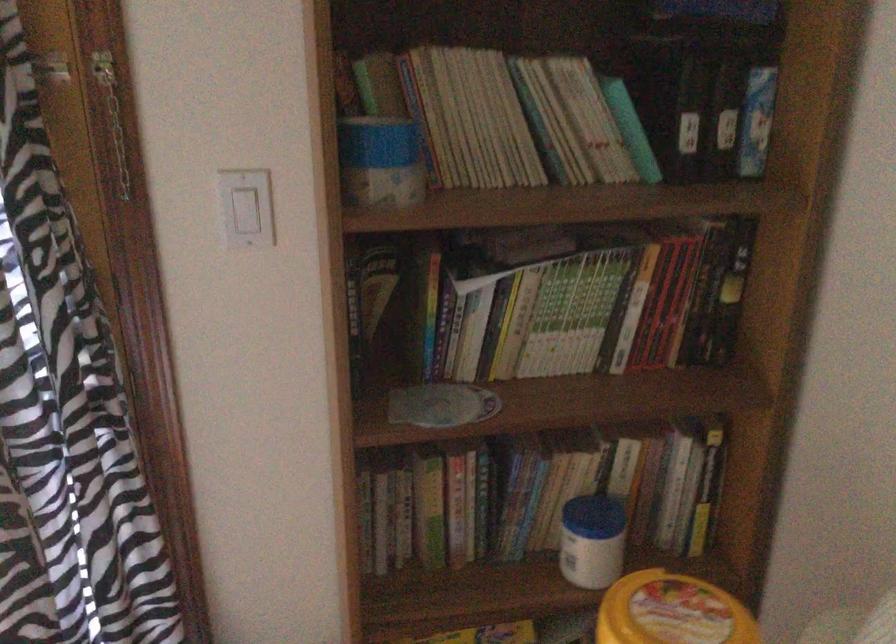
The width and height of the screenshot is (896, 644). I want to click on blue and white container, so click(591, 541).